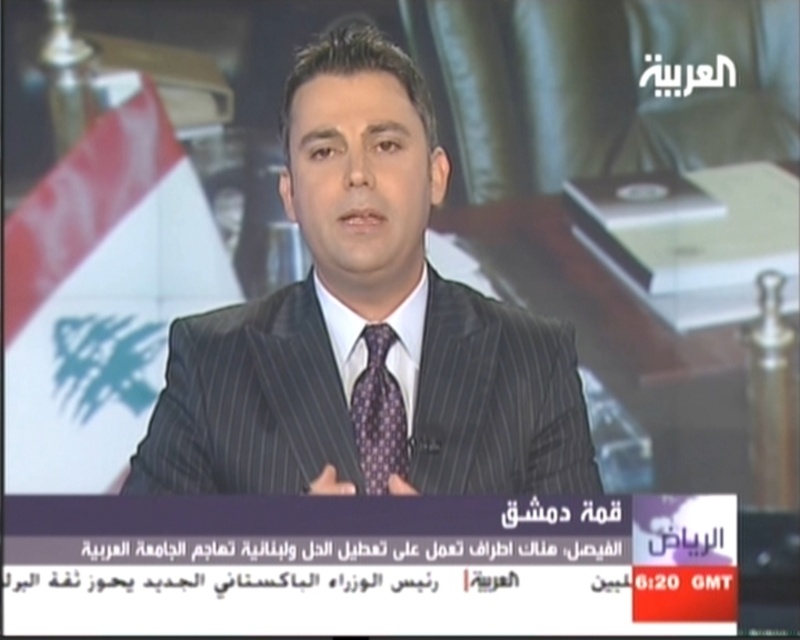
You are a fashion designer observing the news anchor in the studio. You need to determine if the distance between the matte black suit at center and the purple printed tie at center is sufficient for a professional photo shoot. The minimum required distance for a clear focus is 6 inches. Can the current setup work?

The distance between the matte black suit at center and the purple printed tie at center is 6.79 inches, which exceeds the minimum required 6 inches. Therefore, the current setup is suitable for a professional photo shoot.